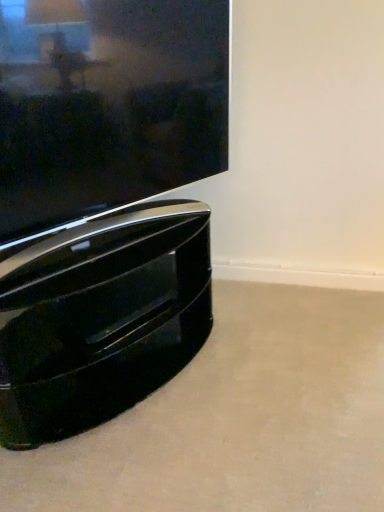
Question: Is glossy black tv at lower left further to the viewer compared to glossy black tv stand at lower left?

Choices:
 (A) yes
 (B) no

Answer: (B)

Question: Is glossy black tv at lower left next to glossy black tv stand at lower left and touching it?

Choices:
 (A) no
 (B) yes

Answer: (A)

Question: Does glossy black tv at lower left have a lesser width compared to glossy black tv stand at lower left?

Choices:
 (A) yes
 (B) no

Answer: (A)

Question: Is glossy black tv at lower left shorter than glossy black tv stand at lower left?

Choices:
 (A) yes
 (B) no

Answer: (B)

Question: Does glossy black tv at lower left turn towards glossy black tv stand at lower left?

Choices:
 (A) no
 (B) yes

Answer: (A)

Question: Considering the relative positions of glossy black tv at lower left and glossy black tv stand at lower left in the image provided, is glossy black tv at lower left to the right of glossy black tv stand at lower left from the viewer's perspective?

Choices:
 (A) no
 (B) yes

Answer: (B)

Question: From a real-world perspective, is glossy black tv stand at lower left on glossy black tv at lower left?

Choices:
 (A) no
 (B) yes

Answer: (A)

Question: Does glossy black tv stand at lower left appear on the left side of glossy black tv at lower left?

Choices:
 (A) no
 (B) yes

Answer: (B)

Question: Does glossy black tv stand at lower left have a lesser width compared to glossy black tv at lower left?

Choices:
 (A) no
 (B) yes

Answer: (A)

Question: Is glossy black tv stand at lower left not inside glossy black tv at lower left?

Choices:
 (A) yes
 (B) no

Answer: (A)

Question: Does glossy black tv stand at lower left come behind glossy black tv at lower left?

Choices:
 (A) yes
 (B) no

Answer: (A)

Question: From the image's perspective, is glossy black tv stand at lower left above glossy black tv at lower left?

Choices:
 (A) no
 (B) yes

Answer: (A)

Question: Is point (64, 31) positioned closer to the camera than point (34, 371)?

Choices:
 (A) farther
 (B) closer

Answer: (B)